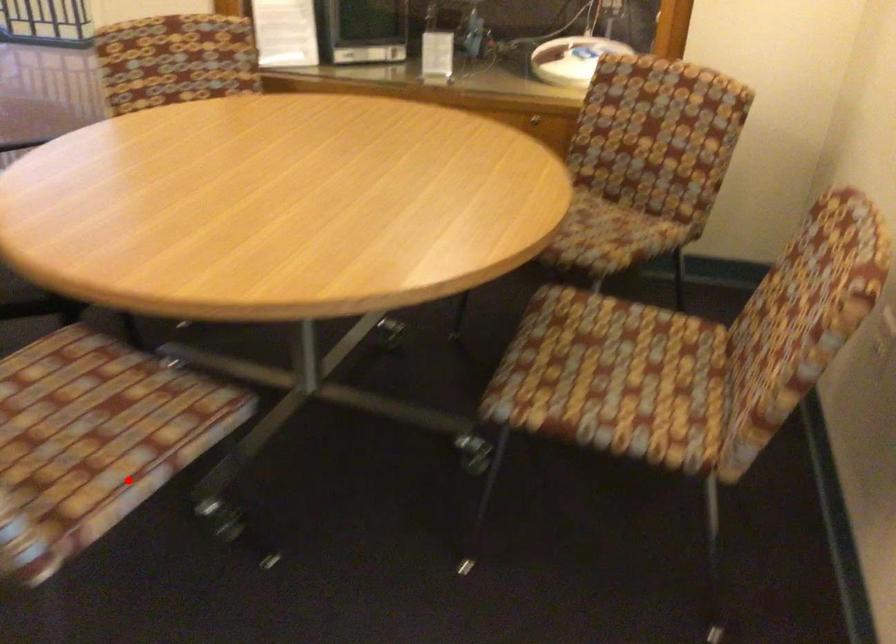
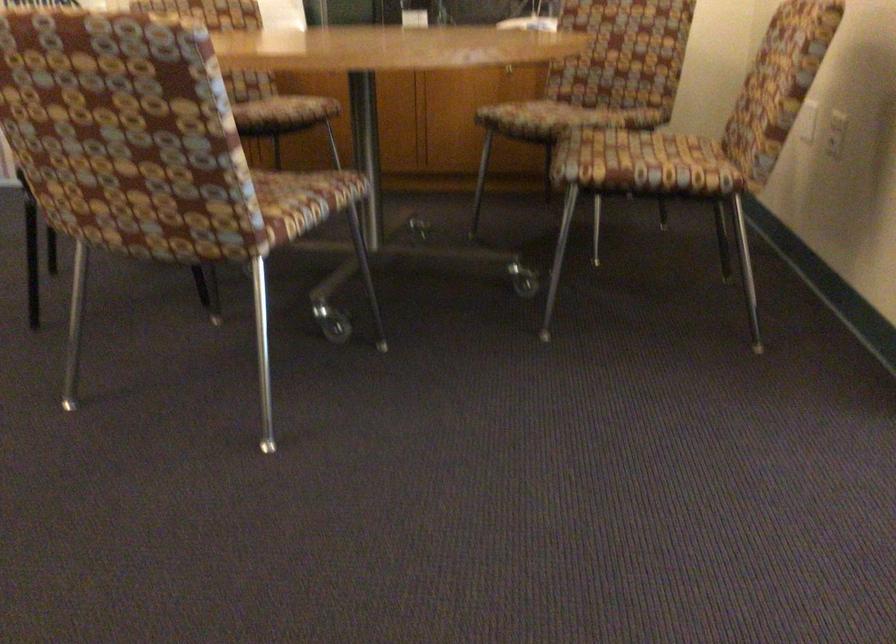
The point at the highlighted location is marked in the first image. Where is the corresponding point in the second image?

(289, 204)